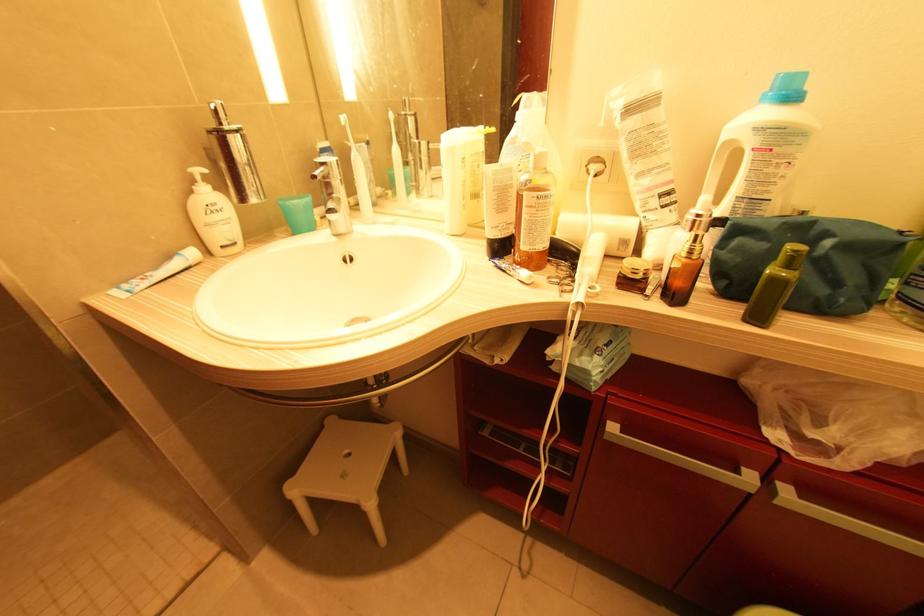
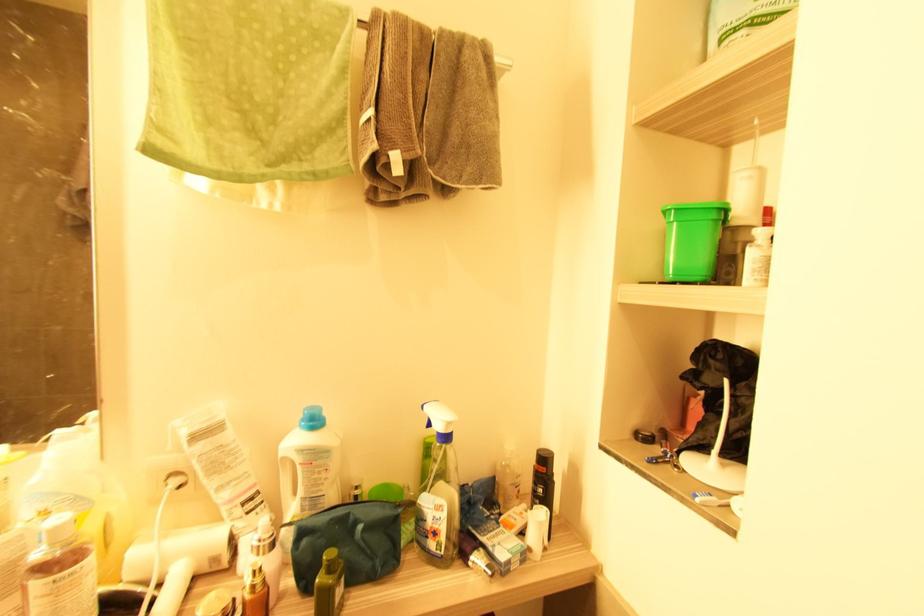
In the second image, find the point that corresponds to point (625, 244) in the first image.

(216, 561)